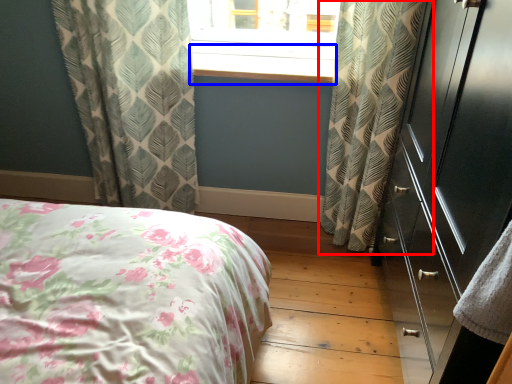
Question: Which of the following is the closest to the observer, curtain (highlighted by a red box) or window sill (highlighted by a blue box)?

Choices:
 (A) curtain
 (B) window sill

Answer: (A)